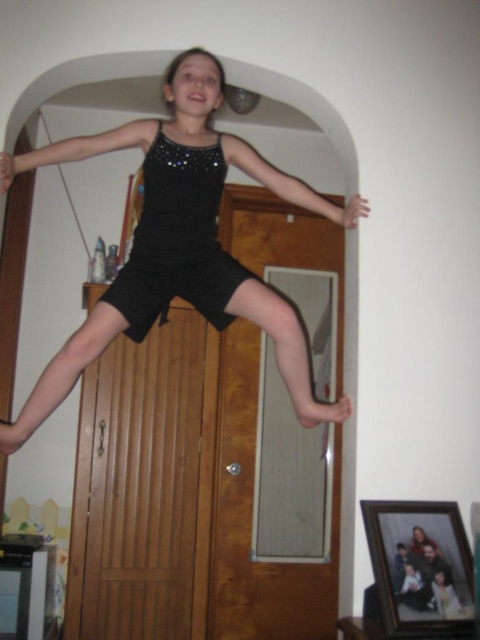
Is black matte shorts at center positioned in front of black satin dress at center?

Yes, it is in front of black satin dress at center.

Between black matte shorts at center and black satin dress at center, which one appears on the right side from the viewer's perspective?

From the viewer's perspective, black matte shorts at center appears more on the right side.

Which is in front, point (182, 56) or point (149, 230)?

Point (182, 56)

You are a GUI agent. You are given a task and a screenshot of the screen. Output one action in this format:
    pyautogui.click(x=<x>, y=<y>)
    Task: Click on the black matte shorts at center
    The height and width of the screenshot is (640, 480).
    Given the screenshot: What is the action you would take?
    pyautogui.click(x=143, y=120)